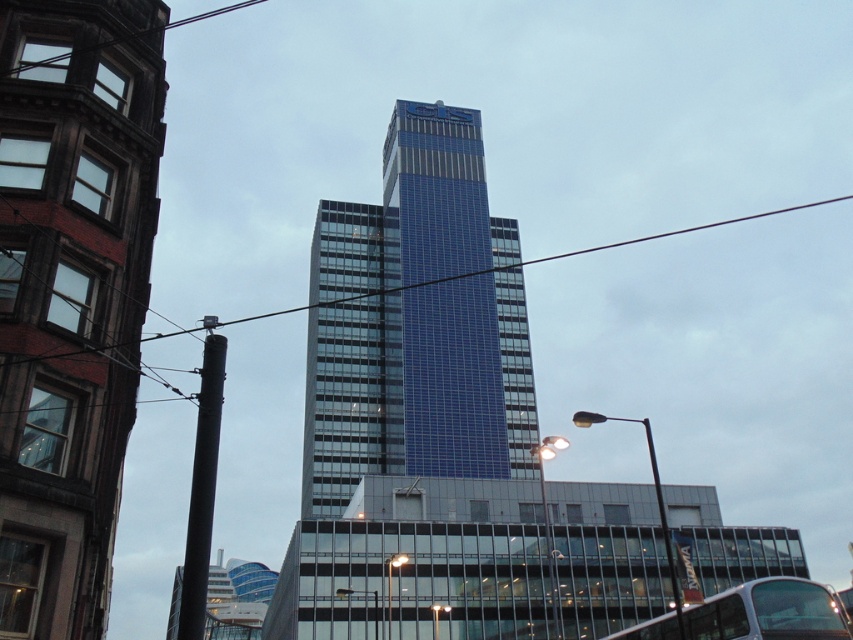
You are a pedestrian standing at the corner of the street. You see the blue glass building at center and the silver metallic bus at lower right. Which object is closer to you?

The blue glass building at center is closer to you because the silver metallic bus at lower right is behind it.

Based on the photo, you are a city planner reviewing architectural plans. You notice two structures in the design proposal labeled as the blue glassy tower at center and the blue glass building at center. Based on the provided urban scene, which of these two structures is the bigger one?

The blue glassy tower at center is larger in size than the blue glass building at center, so the blue glassy tower at center is the bigger one.